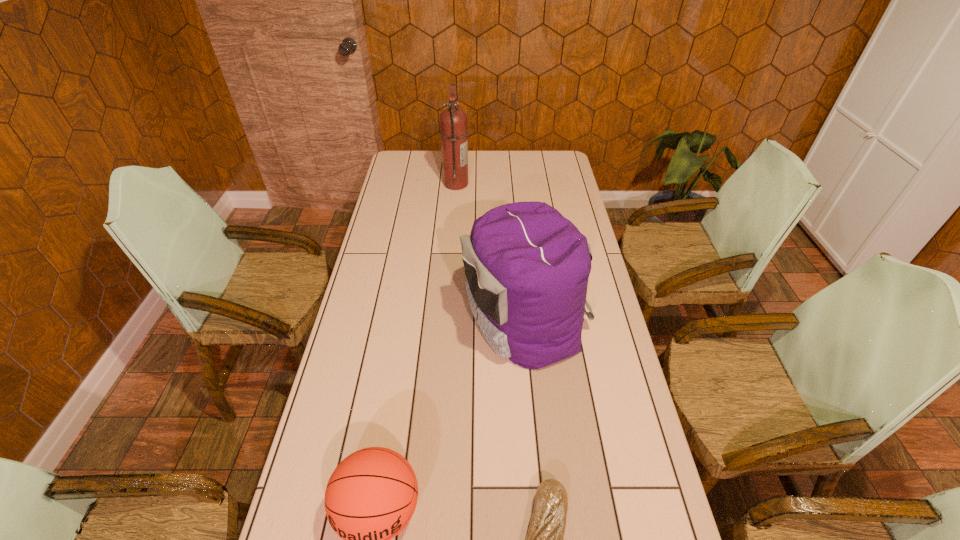
Where is `fire extinguisher`? The height and width of the screenshot is (540, 960). fire extinguisher is located at coordinates (453, 121).

At what (x,y) coordinates should I click in order to perform the action: click on the third nearest object. Please return your answer as a coordinate pair (x, y). The height and width of the screenshot is (540, 960). Looking at the image, I should click on (527, 266).

Locate an element on the screen. vacant space located 0.170m on the front-facing side of the farthest object is located at coordinates coord(505,184).

Image resolution: width=960 pixels, height=540 pixels. Find the location of `free space located on the front pocket of the second farthest object`. free space located on the front pocket of the second farthest object is located at coordinates (387, 320).

Identify the location of vacant region located 0.100m on the front pocket of the second farthest object. (432, 320).

Where is `vacant space located on the front pocket of the second farthest object`? This screenshot has width=960, height=540. vacant space located on the front pocket of the second farthest object is located at coordinates (425, 320).

Identify the location of object present at the far edge. The image size is (960, 540). (453, 121).

Find the location of `object at the right edge`. object at the right edge is located at coordinates (527, 266).

Image resolution: width=960 pixels, height=540 pixels. Identify the location of vacant space at the far edge of the desktop. (480, 151).

Where is `free space at the left edge of the desktop`? The image size is (960, 540). free space at the left edge of the desktop is located at coordinates (338, 406).